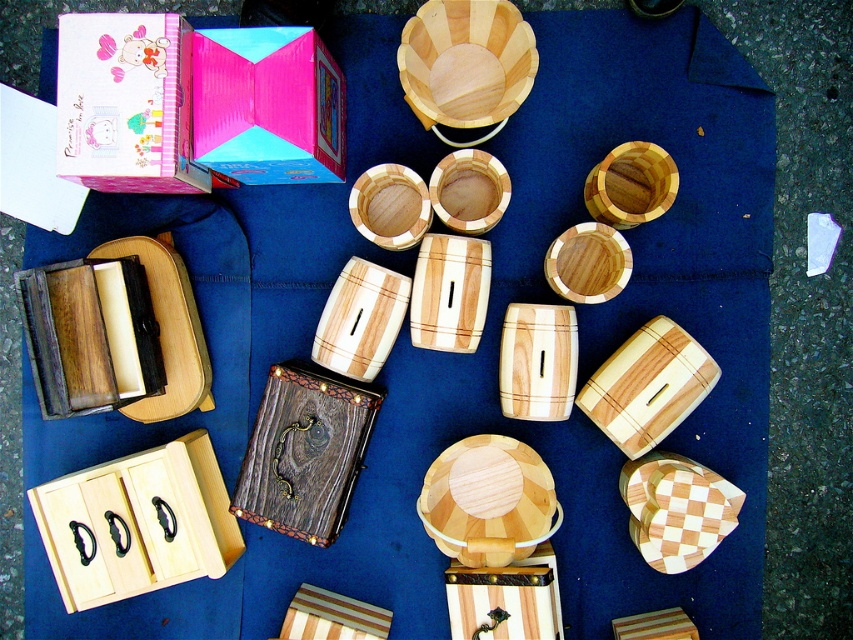
Which of these two, natural wood drawer at lower left or pink matte box at upper left, stands shorter?

pink matte box at upper left is shorter.

From the picture: Can you confirm if natural wood drawer at lower left is wider than pink matte box at upper left?

Correct, the width of natural wood drawer at lower left exceeds that of pink matte box at upper left.

Identify the location of natural wood drawer at lower left. (137, 524).

Does natural wood drawer at lower left have a greater height compared to pink cardboard box at upper center?

Yes, natural wood drawer at lower left is taller than pink cardboard box at upper center.

You are a GUI agent. You are given a task and a screenshot of the screen. Output one action in this format:
    pyautogui.click(x=<x>, y=<y>)
    Task: Click on the natural wood drawer at lower left
    This screenshot has height=640, width=853.
    Given the screenshot: What is the action you would take?
    pyautogui.click(x=137, y=524)

Is point (142, 474) behind point (282, 60)?

Yes, it is behind point (282, 60).

The image size is (853, 640). I want to click on natural wood drawer at lower left, so click(137, 524).

Is point (167, 28) farther from viewer compared to point (271, 132)?

No, it is in front of (271, 132).

Does pink matte box at upper left appear over pink cardboard box at upper center?

Indeed, pink matte box at upper left is positioned over pink cardboard box at upper center.

Find the location of a particular element. pink matte box at upper left is located at coordinates (126, 104).

I want to click on pink matte box at upper left, so click(x=126, y=104).